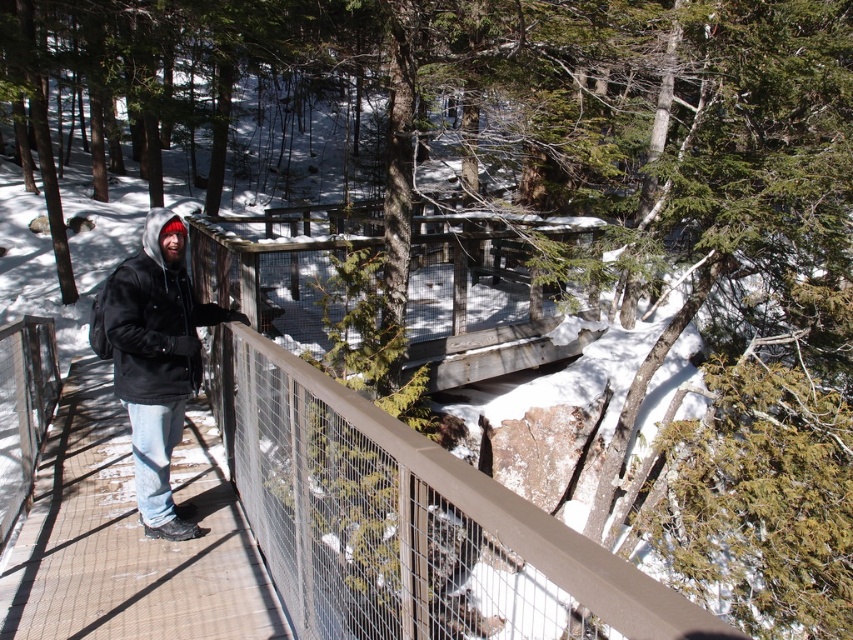
Which of these two, wooden planks at center or black matte jacket at left, stands taller?

Standing taller between the two is black matte jacket at left.

Looking at this image, between wooden planks at center and black matte jacket at left, which one has less height?

With less height is wooden planks at center.

The height and width of the screenshot is (640, 853). What do you see at coordinates (482, 301) in the screenshot?
I see `wooden planks at center` at bounding box center [482, 301].

At what (x,y) coordinates should I click in order to perform the action: click on wooden planks at center. Please return your answer as a coordinate pair (x, y). This screenshot has width=853, height=640. Looking at the image, I should click on (482, 301).